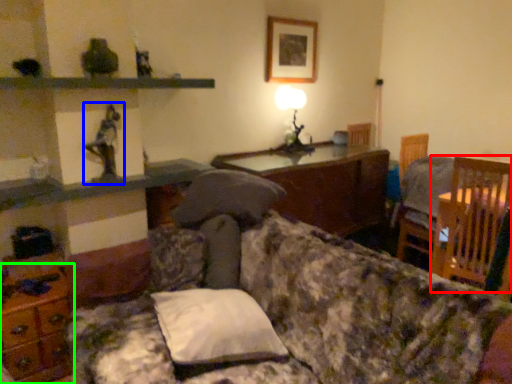
Question: Which object is the farthest from chair (highlighted by a red box)? Choose among these: toy (highlighted by a blue box) or dresser (highlighted by a green box).

Choices:
 (A) toy
 (B) dresser

Answer: (B)